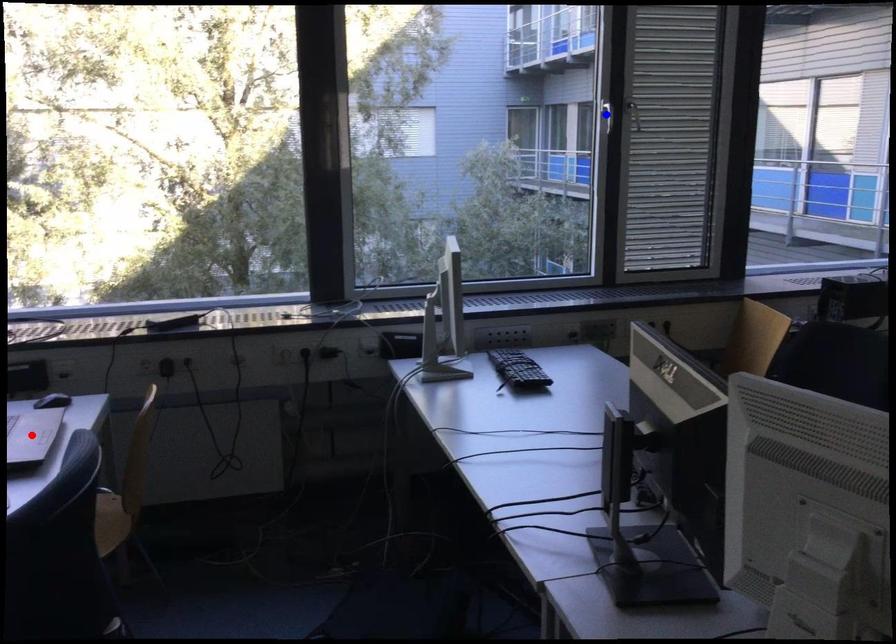
Question: Which of the two points in the image is closer to the camera?

Choices:
 (A) Blue point is closer.
 (B) Red point is closer.

Answer: (B)